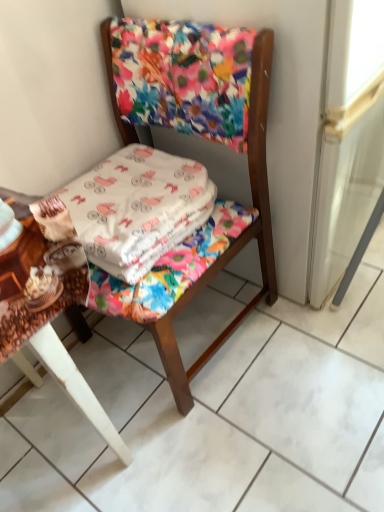
Question: Considering the positions of white cotton blanket at center and floral fabric chair at center in the image, is white cotton blanket at center taller or shorter than floral fabric chair at center?

Choices:
 (A) short
 (B) tall

Answer: (A)

Question: From the image's perspective, is white cotton blanket at center above or below floral fabric chair at center?

Choices:
 (A) above
 (B) below

Answer: (A)

Question: Estimate the real-world distances between objects in this image. Which object is closer to the white cotton blanket at center?

Choices:
 (A) floral fabric screen door at upper center
 (B) wooden table at lower left
 (C) floral fabric chair at center

Answer: (C)

Question: Estimate the real-world distances between objects in this image. Which object is farther from the white cotton blanket at center?

Choices:
 (A) wooden table at lower left
 (B) floral fabric chair at center
 (C) floral fabric screen door at upper center

Answer: (A)